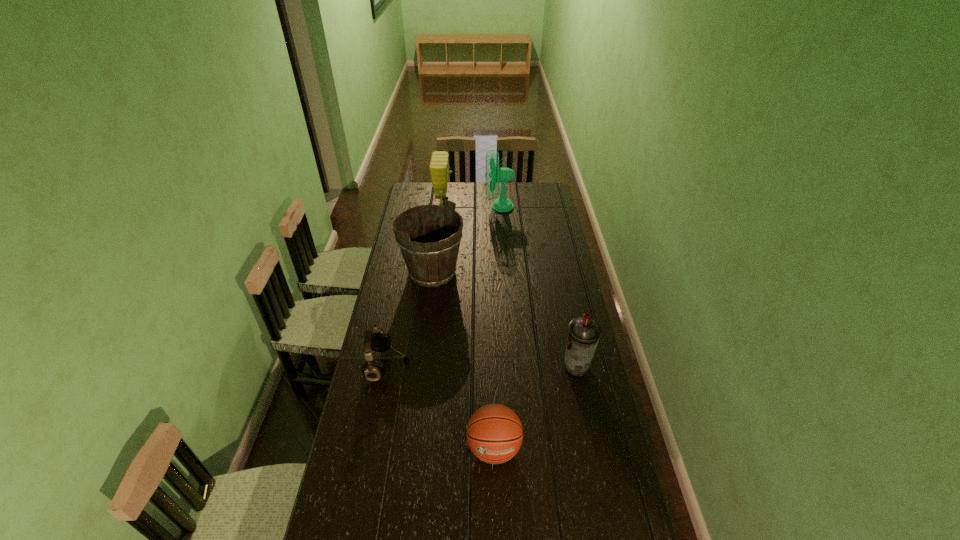
Where is `free spot between the fan and the sponge`? The width and height of the screenshot is (960, 540). free spot between the fan and the sponge is located at coordinates pyautogui.click(x=471, y=205).

Where is `the third closest object to the bucket`? This screenshot has height=540, width=960. the third closest object to the bucket is located at coordinates (439, 166).

I want to click on object that is the third closest to the basketball, so click(430, 263).

Find the location of `vacant space that satisfies the following two spatial constraints: 1. in front of the fan to blow air; 2. on the logo side of the basketball`. vacant space that satisfies the following two spatial constraints: 1. in front of the fan to blow air; 2. on the logo side of the basketball is located at coordinates pos(514,448).

Locate an element on the screen. free spot that satisfies the following two spatial constraints: 1. in front of the fan to blow air; 2. on the logo side of the basketball is located at coordinates pos(514,448).